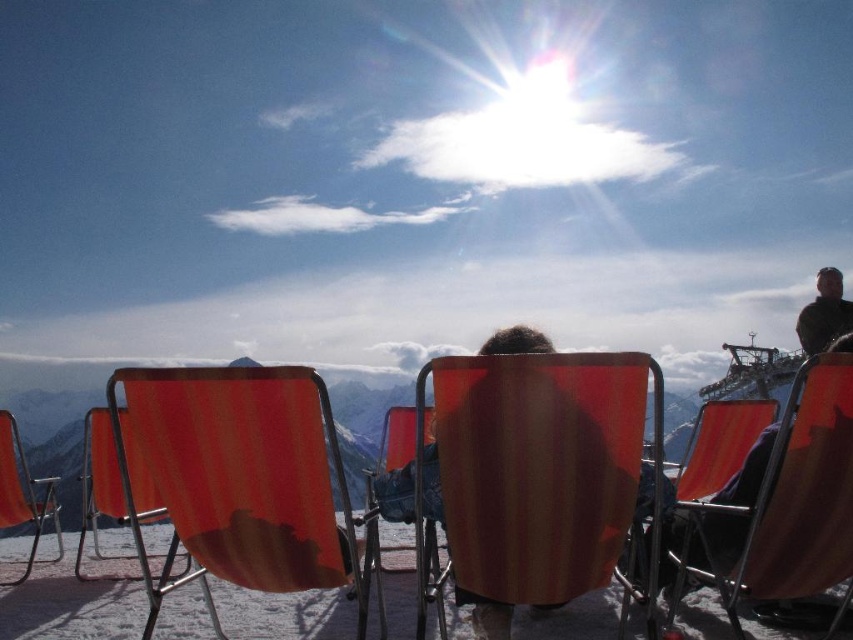
Question: Is orange fabric chair at center positioned in front of matte orange chair at left?

Choices:
 (A) yes
 (B) no

Answer: (A)

Question: Based on their relative distances, which object is nearer to the orange fabric chair at center?

Choices:
 (A) matte orange beach chair at center
 (B) dark brown leather jacket at upper right

Answer: (A)

Question: From the image, what is the correct spatial relationship of orange fabric beach chair at center in relation to matte orange chair at left?

Choices:
 (A) left
 (B) right

Answer: (B)

Question: Which point appears farthest from the camera in this image?

Choices:
 (A) (550, 486)
 (B) (822, 336)
 (C) (289, 417)

Answer: (B)

Question: Considering the real-world distances, which object is farthest from the orange fabric beach chair at center?

Choices:
 (A) matte orange chair at left
 (B) matte orange chair at center
 (C) orange fabric chair at center

Answer: (C)

Question: Is matte orange beach chair at center positioned at the back of dark brown leather jacket at upper right?

Choices:
 (A) yes
 (B) no

Answer: (B)